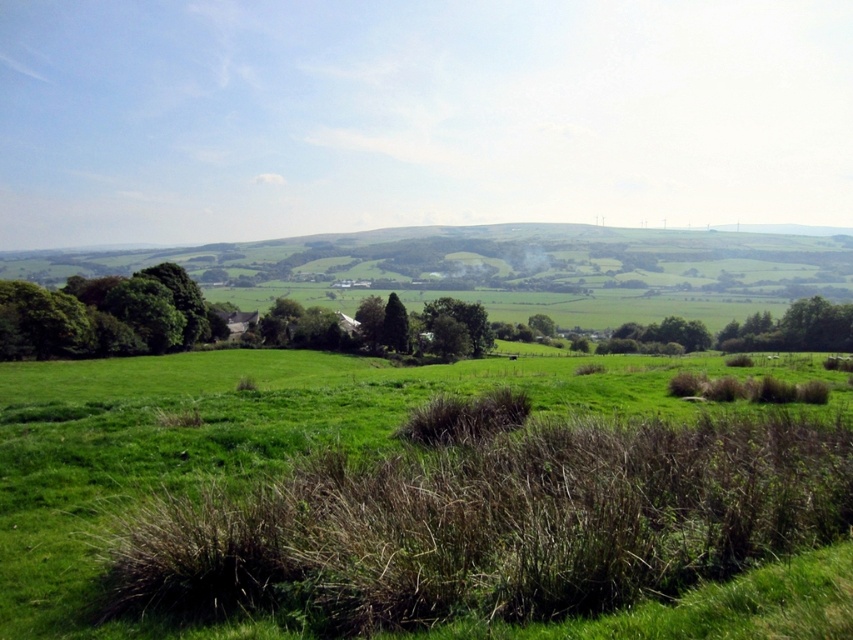
Who is higher up, green leafy tree at left or green leafy tree at lower right?

green leafy tree at left is above.

Which is behind, point (83, 321) or point (752, 344)?

Positioned behind is point (752, 344).

The height and width of the screenshot is (640, 853). Find the location of `green leafy tree at left`. green leafy tree at left is located at coordinates (106, 316).

Between green grassy field at center and green leafy tree at center, which one is positioned lower?

green grassy field at center

Where is `green grassy field at center`? The height and width of the screenshot is (640, 853). green grassy field at center is located at coordinates (251, 445).

Which is behind, point (612, 632) or point (479, 320)?

The point (479, 320) is more distant.

What are the coordinates of `green grassy field at center` in the screenshot? It's located at (251, 445).

Which is behind, point (796, 317) or point (469, 305)?

Positioned behind is point (469, 305).

What do you see at coordinates (793, 328) in the screenshot?
I see `green leafy tree at lower right` at bounding box center [793, 328].

Image resolution: width=853 pixels, height=640 pixels. Find the location of `green leafy tree at lower right`. green leafy tree at lower right is located at coordinates (793, 328).